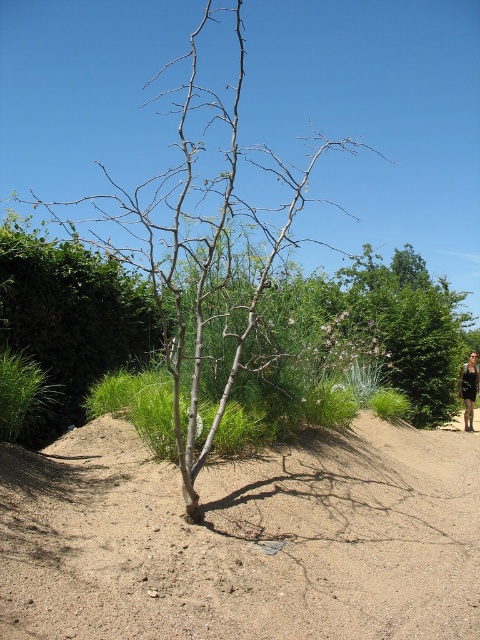
You are a hiker carrying a 3 meter long tent pole. You want to set up your tent between the brown sandy soil at center and the bare wood tree at center. Is there enough space to place the tent pole horizontally between them?

The distance between the brown sandy soil at center and the bare wood tree at center is 7.13 meters. Since the tent pole is 3 meters long, there is sufficient space to place it horizontally between them as 7.13 meters is greater than 3 meters.

You are a photographer trying to capture the bare wood tree at center and the black leather dress at lower right in the same frame. Based on their sizes, which one will appear taller in the photo?

The bare wood tree at center will appear taller in the photo since it has a greater height compared to the black leather dress at lower right as stated in the description.